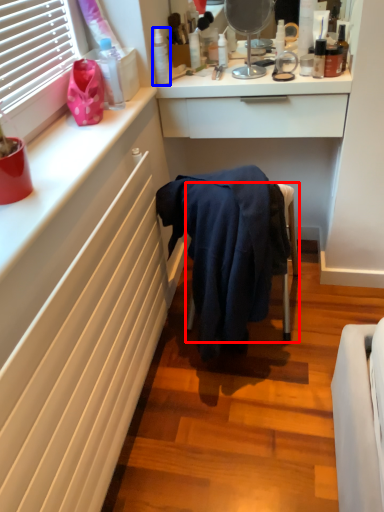
Question: Which object appears closest to the camera in this image, furniture (highlighted by a red box) or toiletry (highlighted by a blue box)?

Choices:
 (A) furniture
 (B) toiletry

Answer: (A)